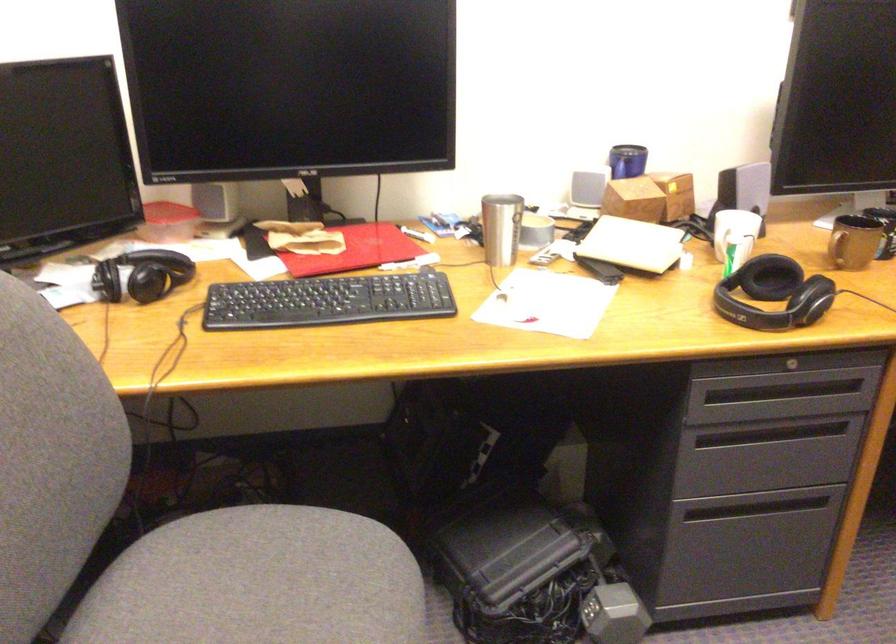
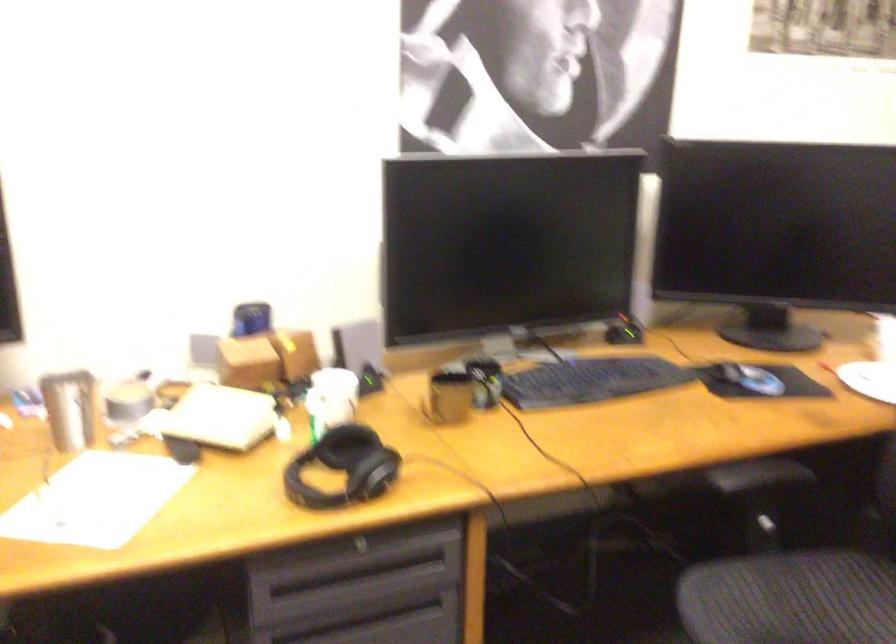
Question: How did the camera likely rotate?

Choices:
 (A) Left
 (B) Right
 (C) Up
 (D) Down

Answer: (B)